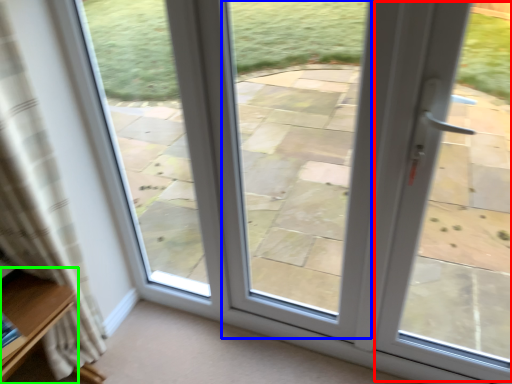
Question: Considering the real-world distances, which object is closest to screen door (highlighted by a red box)? window (highlighted by a blue box) or furniture (highlighted by a green box).

Choices:
 (A) window
 (B) furniture

Answer: (A)